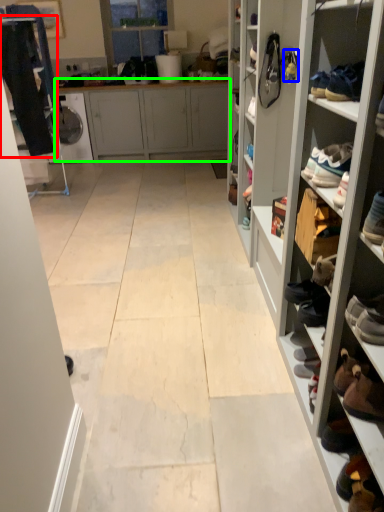
Question: Which object is positioned closest to clothing (highlighted by a red box)? Select from shoe (highlighted by a blue box) and cabinetry (highlighted by a green box).

Choices:
 (A) shoe
 (B) cabinetry

Answer: (B)